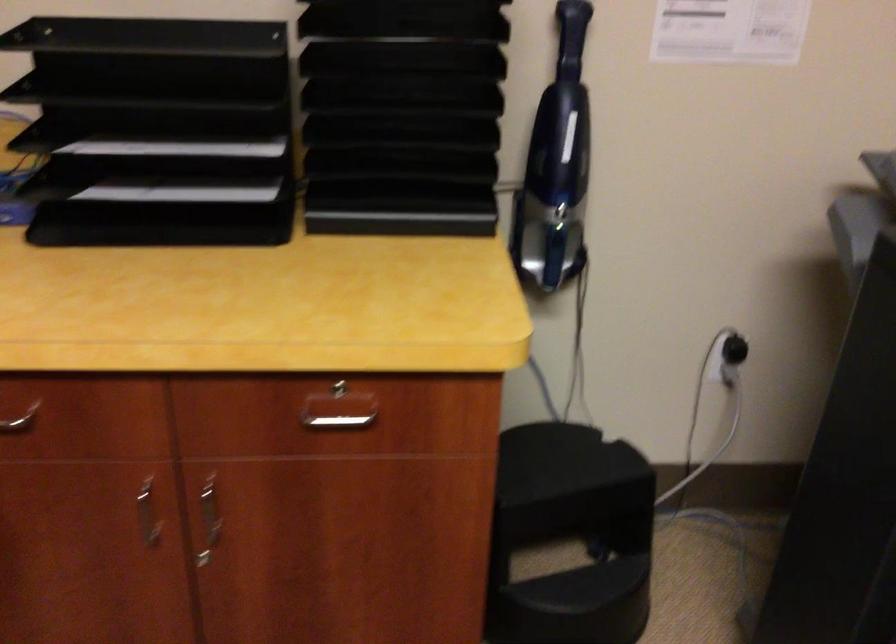
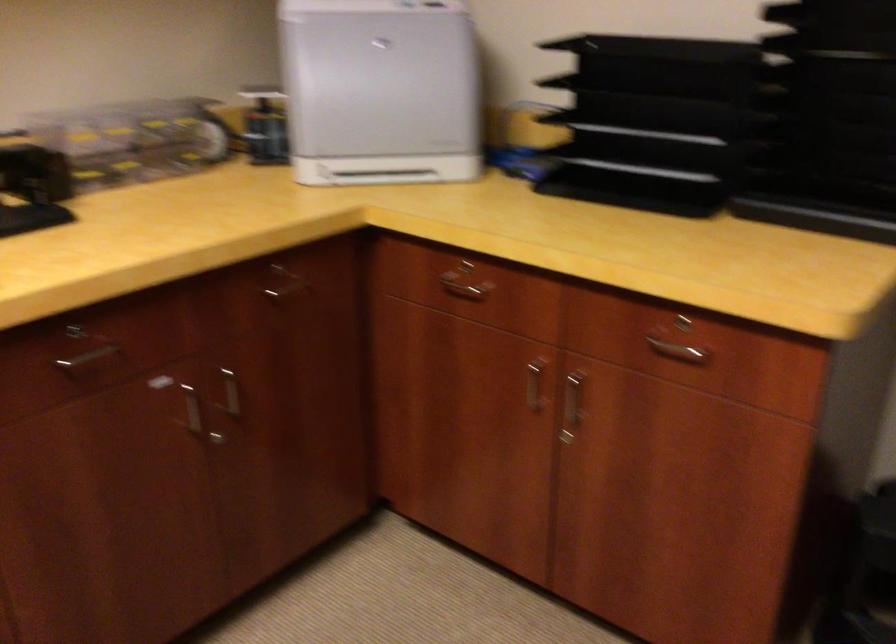
The point at (x=139, y=509) is marked in the first image. Where is the corresponding point in the second image?

(533, 386)